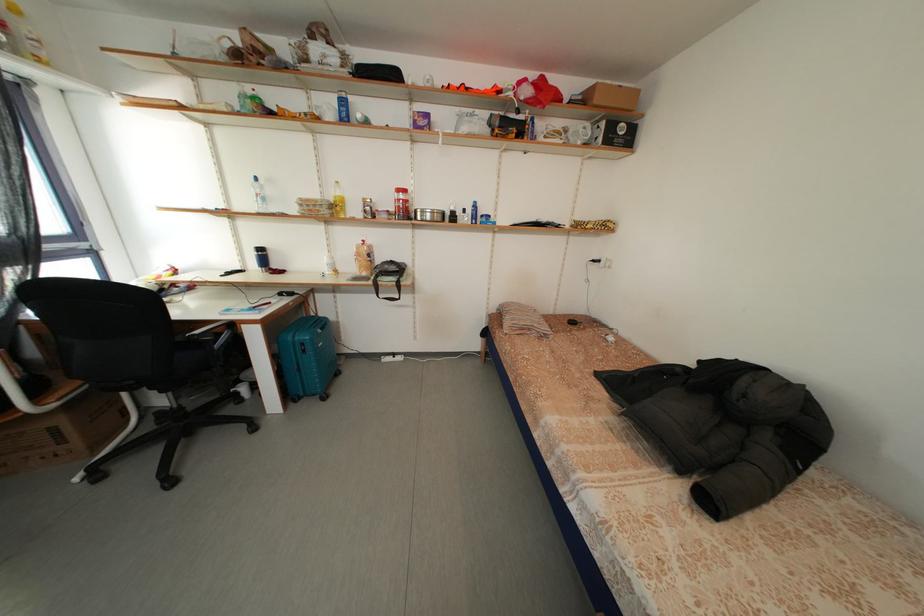
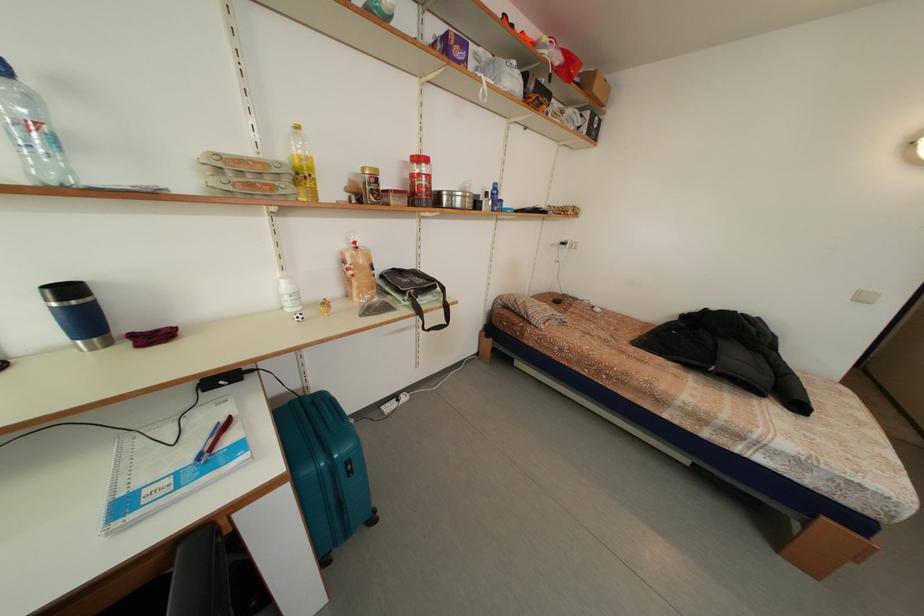
The point at (371, 246) is marked in the first image. Where is the corresponding point in the second image?

(362, 248)